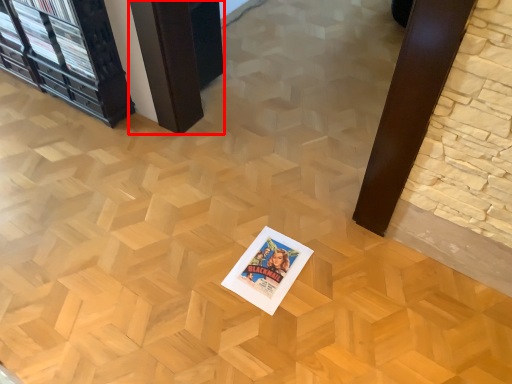
Question: From the image's perspective, where is table (annotated by the red box) located in relation to postcard in the image?

Choices:
 (A) above
 (B) below

Answer: (A)